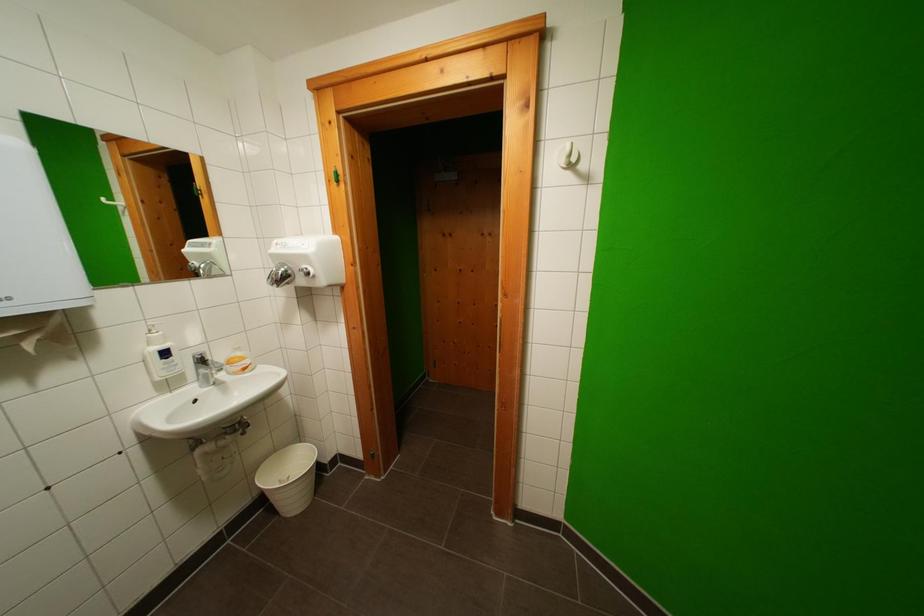
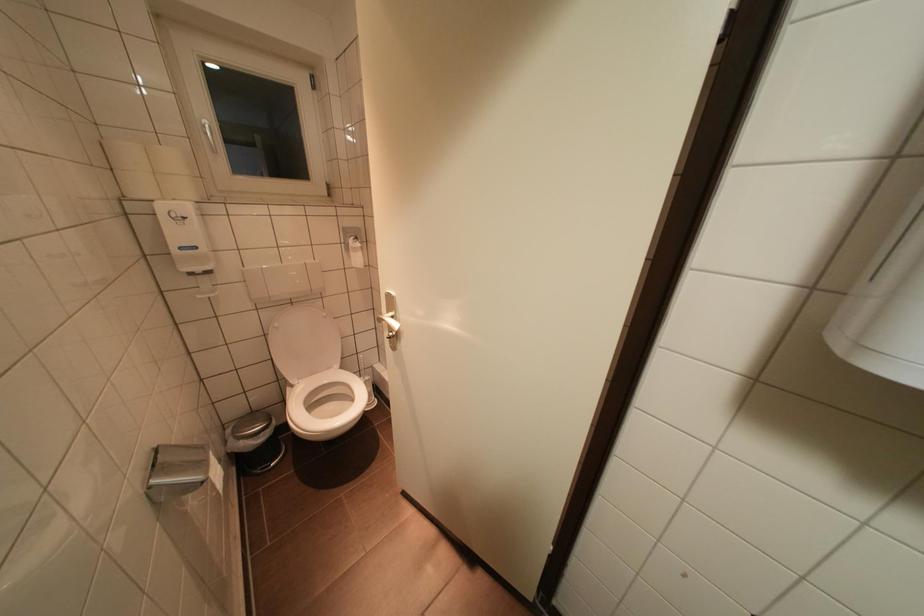
First-person continuous shooting, in which direction is the camera rotating?

The camera's rotation is toward left-down.